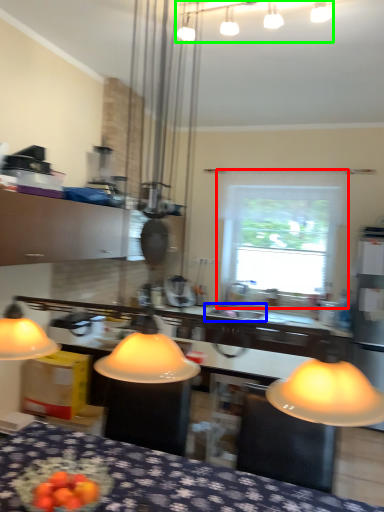
Question: Which is farther away from window (highlighted by a red box)? sink (highlighted by a blue box) or lamp (highlighted by a green box)?

Choices:
 (A) sink
 (B) lamp

Answer: (A)